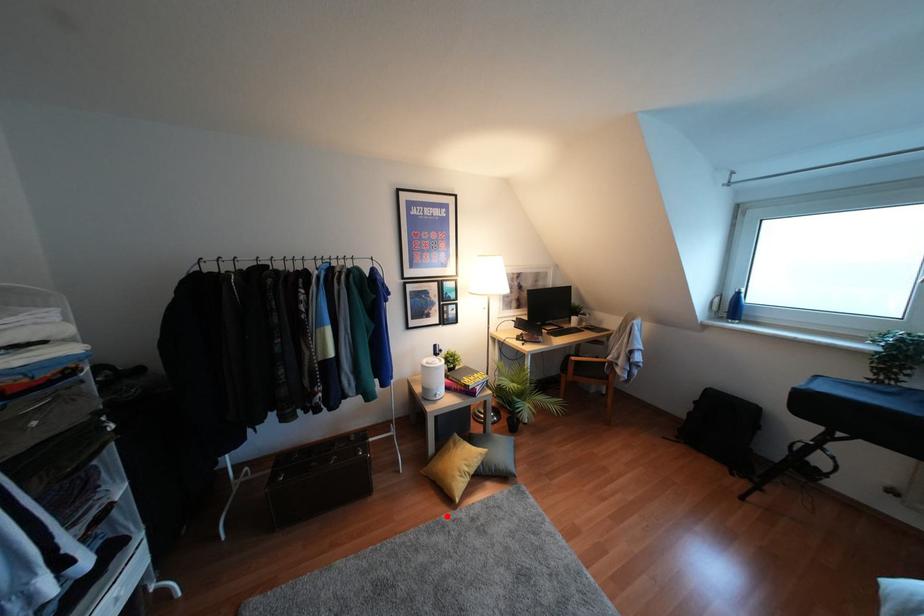
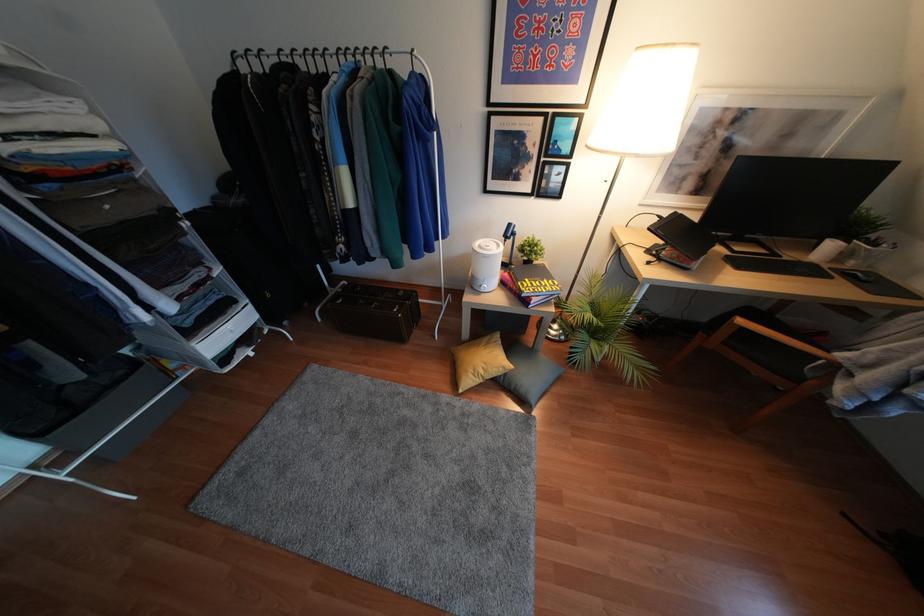
Question: I am providing you with two images of the same scene from different viewpoints. A red point is shown in image1. For the corresponding object point in image2, is it positioned nearer or farther from the camera?

Choices:
 (A) Nearer
 (B) Farther

Answer: (A)